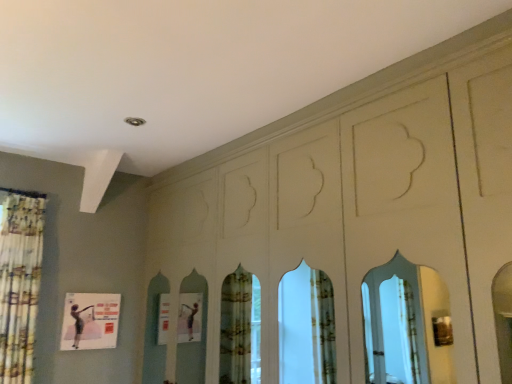
Image resolution: width=512 pixels, height=384 pixels. What do you see at coordinates (90, 321) in the screenshot?
I see `matte pink poster at lower left` at bounding box center [90, 321].

Locate an element on the screen. matte pink poster at lower left is located at coordinates (90, 321).

In order to face matte pink poster at lower left, should I rotate leftwards or rightwards?

Turn left by 21.120 degrees to look at matte pink poster at lower left.

You are a GUI agent. You are given a task and a screenshot of the screen. Output one action in this format:
    pyautogui.click(x=<x>, y=<y>)
    Task: Click on the floral fabric shower curtain at left
    The width and height of the screenshot is (512, 384).
    Given the screenshot: What is the action you would take?
    pyautogui.click(x=19, y=281)

What do you see at coordinates (19, 281) in the screenshot?
I see `floral fabric shower curtain at left` at bounding box center [19, 281].

Identify the location of matte pink poster at lower left. This screenshot has width=512, height=384. (90, 321).

Which is more to the right, matte pink poster at lower left or floral fabric shower curtain at left?

matte pink poster at lower left is more to the right.

Which object is more forward, matte pink poster at lower left or floral fabric shower curtain at left?

floral fabric shower curtain at left is in front.

Does point (85, 305) appear closer or farther from the camera than point (36, 306)?

Clearly, point (85, 305) is more distant from the camera than point (36, 306).

From the image's perspective, between matte pink poster at lower left and floral fabric shower curtain at left, who is located below?

matte pink poster at lower left is shown below in the image.

From a real-world perspective, which is physically above, matte pink poster at lower left or floral fabric shower curtain at left?

floral fabric shower curtain at left is physically above.

Considering the relative sizes of matte pink poster at lower left and floral fabric shower curtain at left in the image provided, is matte pink poster at lower left thinner than floral fabric shower curtain at left?

Indeed, matte pink poster at lower left has a lesser width compared to floral fabric shower curtain at left.

Considering the relative sizes of matte pink poster at lower left and floral fabric shower curtain at left in the image provided, is matte pink poster at lower left taller than floral fabric shower curtain at left?

In fact, matte pink poster at lower left may be shorter than floral fabric shower curtain at left.

Looking at this image, considering the sizes of objects matte pink poster at lower left and floral fabric shower curtain at left in the image provided, who is smaller, matte pink poster at lower left or floral fabric shower curtain at left?

matte pink poster at lower left is smaller.

Consider the image. Is matte pink poster at lower left positioned beyond the bounds of floral fabric shower curtain at left?

Yes.

Would you consider matte pink poster at lower left to be distant from floral fabric shower curtain at left?

No, matte pink poster at lower left is in close proximity to floral fabric shower curtain at left.

Is matte pink poster at lower left positioned with its back to floral fabric shower curtain at left?

No, floral fabric shower curtain at left is not at the back of matte pink poster at lower left.

How different are the orientations of matte pink poster at lower left and floral fabric shower curtain at left in degrees?

3.53 degrees.

Measure the distance from matte pink poster at lower left to floral fabric shower curtain at left.

matte pink poster at lower left is 16.91 inches away from floral fabric shower curtain at left.

What are the coordinates of `poster behind the floral fabric shower curtain at left` in the screenshot? It's located at (90, 321).

Which object is positioned more to the right, floral fabric shower curtain at left or matte pink poster at lower left?

matte pink poster at lower left.

In the image, is floral fabric shower curtain at left positioned in front of or behind matte pink poster at lower left?

In the image, floral fabric shower curtain at left appears in front of matte pink poster at lower left.

Which is in front, point (10, 213) or point (74, 330)?

The point (10, 213) is in front.

From the image's perspective, which is above, floral fabric shower curtain at left or matte pink poster at lower left?

floral fabric shower curtain at left appears higher in the image.

From a real-world perspective, is floral fabric shower curtain at left below matte pink poster at lower left?

No, from a real-world perspective, floral fabric shower curtain at left is not beneath matte pink poster at lower left.

Considering the sizes of objects floral fabric shower curtain at left and matte pink poster at lower left in the image provided, who is wider, floral fabric shower curtain at left or matte pink poster at lower left?

With larger width is floral fabric shower curtain at left.

Considering the sizes of objects floral fabric shower curtain at left and matte pink poster at lower left in the image provided, who is taller, floral fabric shower curtain at left or matte pink poster at lower left?

floral fabric shower curtain at left.

Considering the relative sizes of floral fabric shower curtain at left and matte pink poster at lower left in the image provided, is floral fabric shower curtain at left smaller than matte pink poster at lower left?

No.

Is floral fabric shower curtain at left located outside matte pink poster at lower left?

That's correct, floral fabric shower curtain at left is outside of matte pink poster at lower left.

Are floral fabric shower curtain at left and matte pink poster at lower left making contact?

There is a gap between floral fabric shower curtain at left and matte pink poster at lower left.

Is floral fabric shower curtain at left turned away from matte pink poster at lower left?

No, floral fabric shower curtain at left's orientation is not away from matte pink poster at lower left.

How many degrees apart are the facing directions of floral fabric shower curtain at left and matte pink poster at lower left?

There is a 3.53-degree angle between the facing directions of floral fabric shower curtain at left and matte pink poster at lower left.

How far apart are floral fabric shower curtain at left and matte pink poster at lower left?

The distance of floral fabric shower curtain at left from matte pink poster at lower left is 16.91 inches.

Where is `shower curtain on the left of matte pink poster at lower left`? This screenshot has width=512, height=384. shower curtain on the left of matte pink poster at lower left is located at coordinates (19, 281).

Find the location of a particular element. Image resolution: width=512 pixels, height=384 pixels. poster below the floral fabric shower curtain at left (from the image's perspective) is located at coordinates (90, 321).

Locate an element on the screen. shower curtain on the left of matte pink poster at lower left is located at coordinates (19, 281).